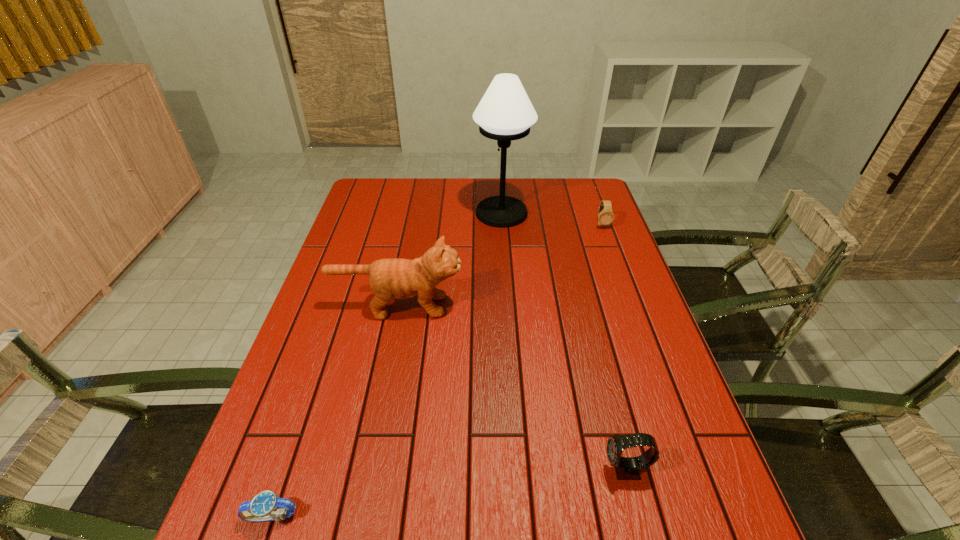
This screenshot has width=960, height=540. Identify the location of blank area at the far edge. (468, 186).

In the image, there is a desktop. Where is `vacant space at the left edge`? vacant space at the left edge is located at coordinates (293, 530).

Find the location of a particular element. The height and width of the screenshot is (540, 960). vacant space at the right edge of the desktop is located at coordinates (575, 213).

Where is `vacant space at the far left corner of the desktop`? Image resolution: width=960 pixels, height=540 pixels. vacant space at the far left corner of the desktop is located at coordinates (399, 194).

The height and width of the screenshot is (540, 960). In the image, there is a desktop. Find the location of `vacant space at the far right corner`. vacant space at the far right corner is located at coordinates (571, 196).

Image resolution: width=960 pixels, height=540 pixels. What are the coordinates of `free space between the shortest object and the table lamp` in the screenshot? It's located at (387, 365).

You are a GUI agent. You are given a task and a screenshot of the screen. Output one action in this format:
    pyautogui.click(x=<x>, y=<y>)
    Task: Click on the free area in between the nearest watch and the farthest watch
    Image resolution: width=960 pixels, height=540 pixels.
    Given the screenshot: What is the action you would take?
    pyautogui.click(x=437, y=371)

Locate an element on the screen. This screenshot has height=540, width=960. empty location between the third object from left to right and the shortest object is located at coordinates (387, 365).

Locate an element on the screen. free space between the table lamp and the farthest watch is located at coordinates (552, 219).

This screenshot has width=960, height=540. What are the coordinates of `free space between the third object from left to right and the nearest object` in the screenshot? It's located at (387, 365).